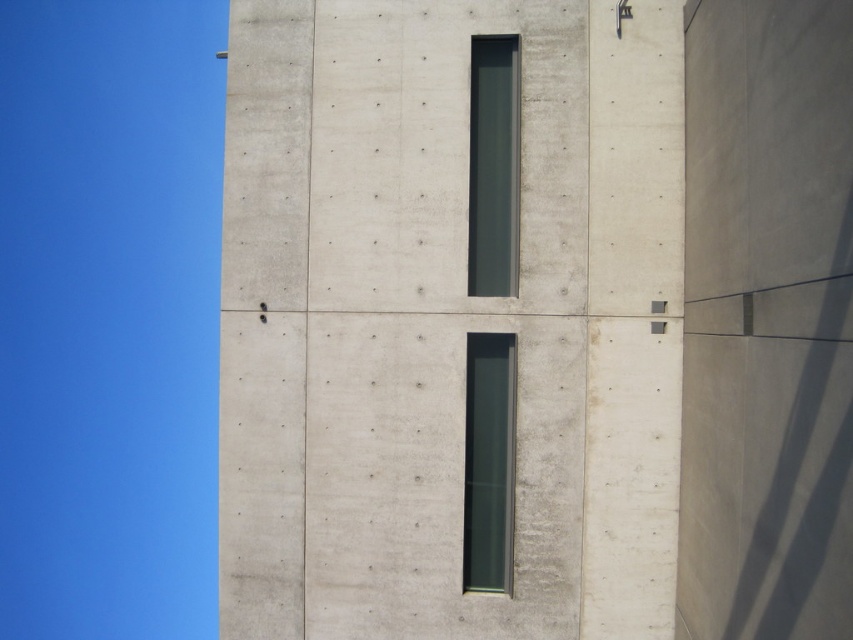
Measure the distance between point (625, 372) and camera.

Point (625, 372) and camera are 54.84 feet apart.

Who is shorter, smooth concrete wall at center or dark gray glass window at upper center?

smooth concrete wall at center is shorter.

I want to click on smooth concrete wall at center, so click(445, 320).

Is smooth concrete wall at center bigger than transparent glass window at center?

No, smooth concrete wall at center is not bigger than transparent glass window at center.

Who is lower down, smooth concrete wall at center or transparent glass window at center?

Answer: Positioned lower is smooth concrete wall at center.

Image resolution: width=853 pixels, height=640 pixels. In order to click on smooth concrete wall at center in this screenshot , I will do (x=445, y=320).

This screenshot has height=640, width=853. Find the location of `smooth concrete wall at center`. smooth concrete wall at center is located at coordinates (445, 320).

Is dark gray glass window at upper center to the left of transparent glass window at center from the viewer's perspective?

Incorrect, dark gray glass window at upper center is not on the left side of transparent glass window at center.

Does dark gray glass window at upper center have a smaller size compared to transparent glass window at center?

Indeed, dark gray glass window at upper center has a smaller size compared to transparent glass window at center.

What do you see at coordinates (492, 166) in the screenshot? I see `dark gray glass window at upper center` at bounding box center [492, 166].

You are a GUI agent. You are given a task and a screenshot of the screen. Output one action in this format:
    pyautogui.click(x=<x>, y=<y>)
    Task: Click on the dark gray glass window at upper center
    This screenshot has height=640, width=853.
    Given the screenshot: What is the action you would take?
    pyautogui.click(x=492, y=166)